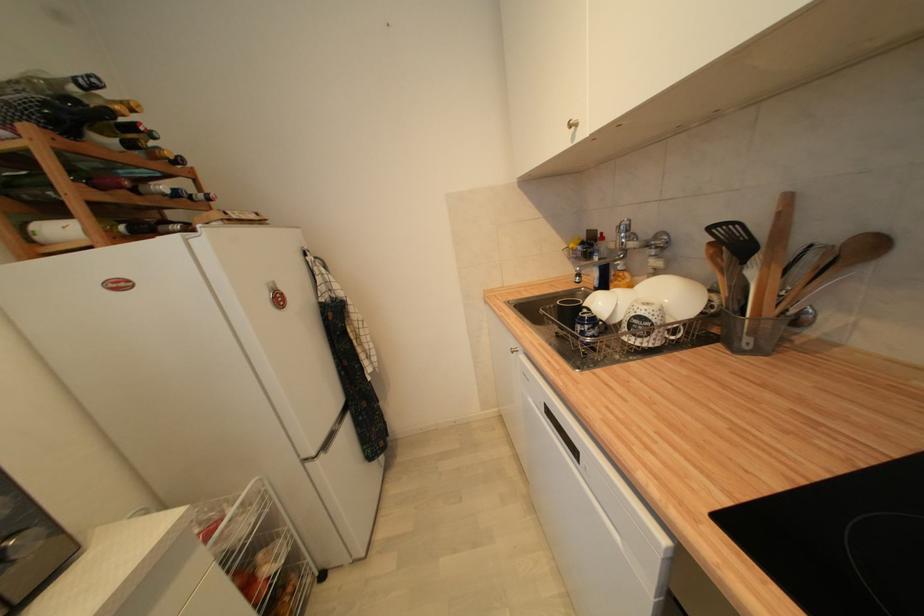
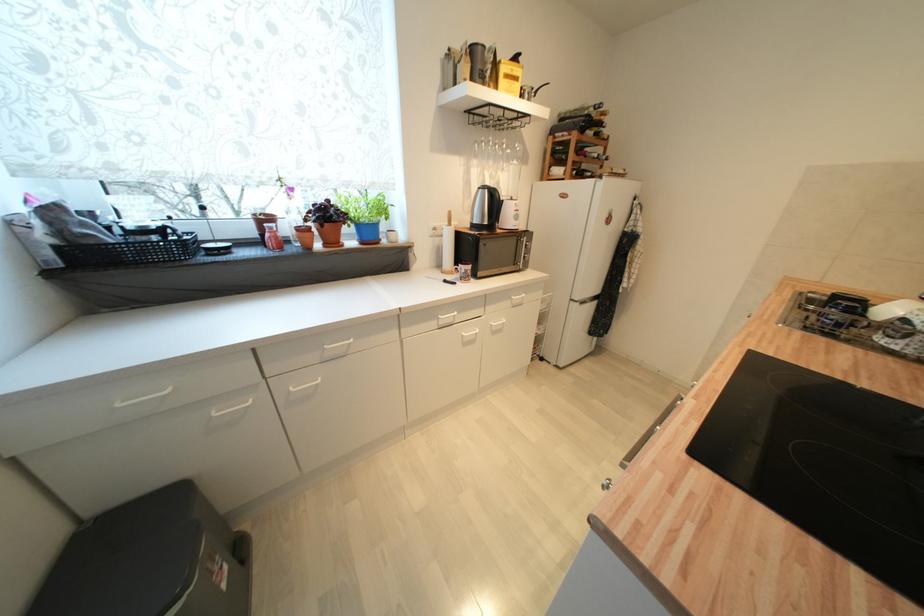
Find the pixel in the second image that matches [332,448] in the first image.

(587, 304)